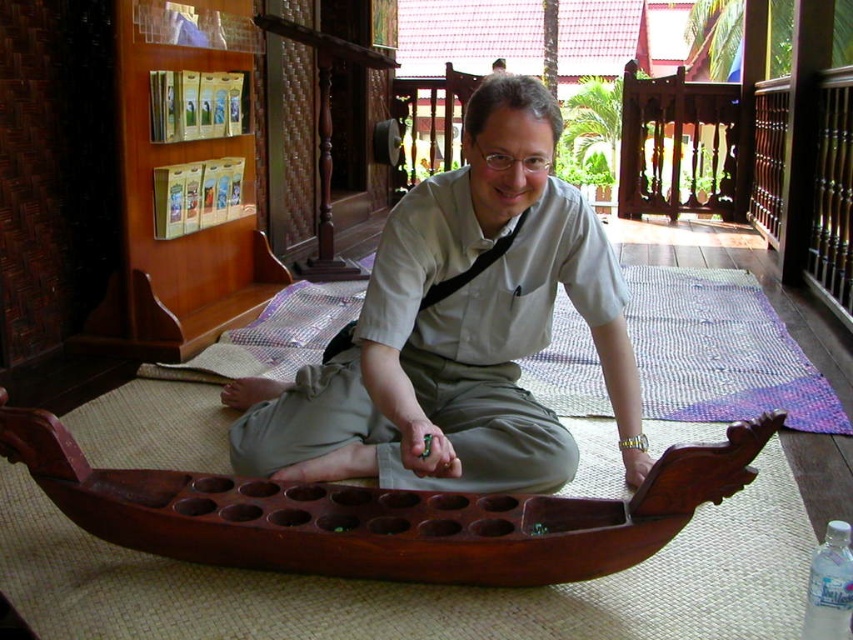
Question: Which of the following is the closest to the observer?

Choices:
 (A) (839, 612)
 (B) (178, 477)
 (C) (415, 464)

Answer: (A)

Question: Can you confirm if matte beige shirt at center is bigger than dark wood rowboat at center?

Choices:
 (A) yes
 (B) no

Answer: (A)

Question: Which point appears closest to the camera in this image?

Choices:
 (A) (422, 346)
 (B) (585, 563)

Answer: (B)

Question: Is matte beige shirt at center further to the viewer compared to dark wood rowboat at center?

Choices:
 (A) no
 (B) yes

Answer: (B)

Question: Does matte beige shirt at center have a smaller size compared to clear plastic bottle at lower right?

Choices:
 (A) yes
 (B) no

Answer: (B)

Question: Which object is the closest to the matte beige shirt at center?

Choices:
 (A) dark wood rowboat at center
 (B) clear plastic bottle at lower right

Answer: (A)